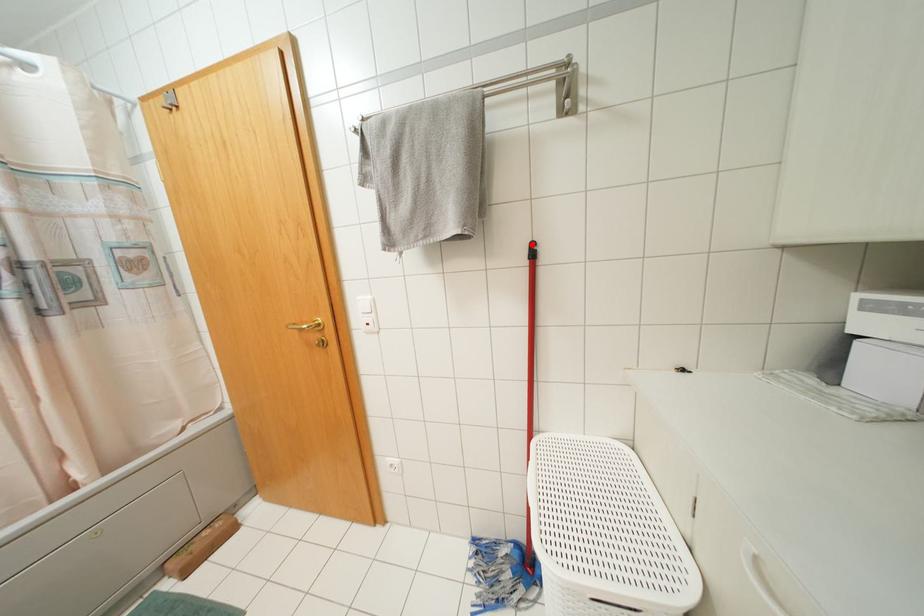
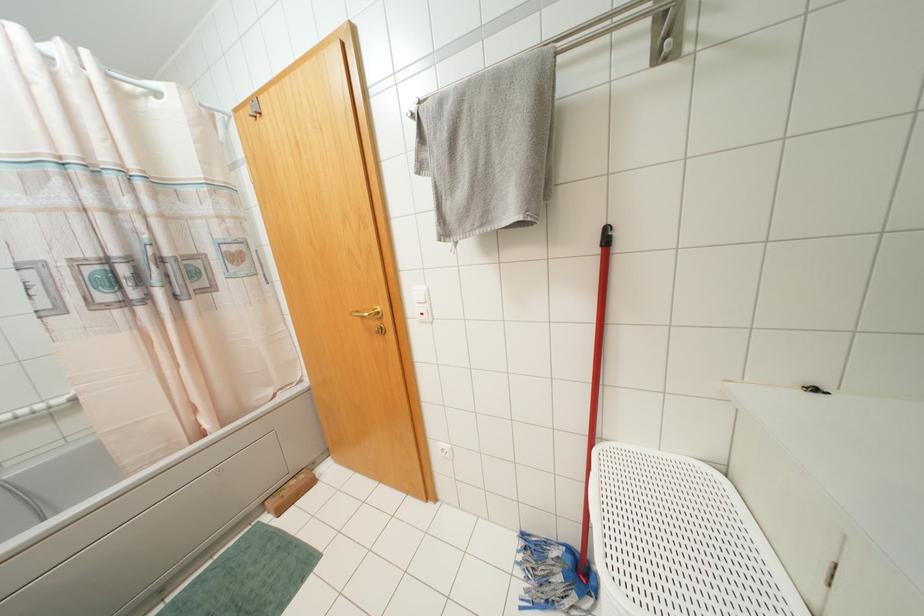
Locate, in the second image, the point that corresponds to the highlighted location in the first image.

(606, 229)